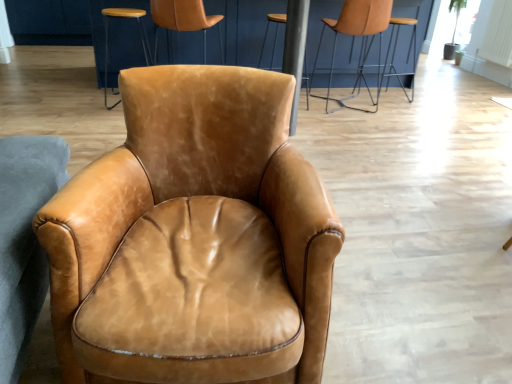
Question: Can you confirm if leather tan chair at upper center, which is the second chair from back to front, is positioned to the left of saddle brown leather armchair at center, the 2th chair in the left-to-right sequence?

Choices:
 (A) yes
 (B) no

Answer: (B)

Question: From a real-world perspective, is leather tan chair at upper center, the 3th chair in the left-to-right sequence, over saddle brown leather armchair at center, which is the 3th chair in right-to-left order?

Choices:
 (A) yes
 (B) no

Answer: (A)

Question: Would you say leather tan chair at upper center, the 3th chair in the left-to-right sequence, is a long distance from saddle brown leather armchair at center, which is the 3th chair in right-to-left order?

Choices:
 (A) no
 (B) yes

Answer: (B)

Question: Is leather tan chair at upper center, which is the 3th chair from front to back, looking in the opposite direction of saddle brown leather armchair at center, which is the 3th chair in right-to-left order?

Choices:
 (A) no
 (B) yes

Answer: (A)

Question: Is leather tan chair at upper center, which is the 3th chair from front to back, closer to the viewer compared to saddle brown leather armchair at center, the fourth chair viewed from the back?

Choices:
 (A) yes
 (B) no

Answer: (B)

Question: In the image, is leather armchair at upper right, positioned as the first chair in right-to-left order, on the left side or the right side of light brown leather stool at upper center?

Choices:
 (A) right
 (B) left

Answer: (A)

Question: In the image, is leather armchair at upper right, arranged as the fourth chair when viewed from the front, positioned in front of or behind light brown leather stool at upper center?

Choices:
 (A) front
 (B) behind

Answer: (B)

Question: From the image's perspective, is leather armchair at upper right, arranged as the fourth chair when viewed from the front, positioned above or below light brown leather stool at upper center?

Choices:
 (A) above
 (B) below

Answer: (A)

Question: Is leather armchair at upper right, the first chair viewed from the back, wider or thinner than light brown leather stool at upper center?

Choices:
 (A) thin
 (B) wide

Answer: (A)

Question: From a real-world perspective, is leather tan chair at upper center, which is the second chair from back to front, positioned above or below light brown leather stool at upper center?

Choices:
 (A) above
 (B) below

Answer: (A)

Question: Considering the positions of leather tan chair at upper center, which is the 3th chair from front to back, and light brown leather stool at upper center in the image, is leather tan chair at upper center, which is the 3th chair from front to back, wider or thinner than light brown leather stool at upper center?

Choices:
 (A) thin
 (B) wide

Answer: (B)

Question: Considering the positions of point (376, 13) and point (123, 8), is point (376, 13) closer or farther from the camera than point (123, 8)?

Choices:
 (A) farther
 (B) closer

Answer: (B)

Question: Considering the relative positions of leather tan chair at upper center, which is the 3th chair from front to back, and light brown leather stool at upper center in the image provided, is leather tan chair at upper center, which is the 3th chair from front to back, to the left or to the right of light brown leather stool at upper center?

Choices:
 (A) left
 (B) right

Answer: (B)

Question: Considering their positions, is brown leather bar stool at center located in front of or behind light brown leather stool at upper center?

Choices:
 (A) behind
 (B) front

Answer: (A)

Question: Considering the positions of brown leather bar stool at center and light brown leather stool at upper center in the image, is brown leather bar stool at center bigger or smaller than light brown leather stool at upper center?

Choices:
 (A) big
 (B) small

Answer: (A)